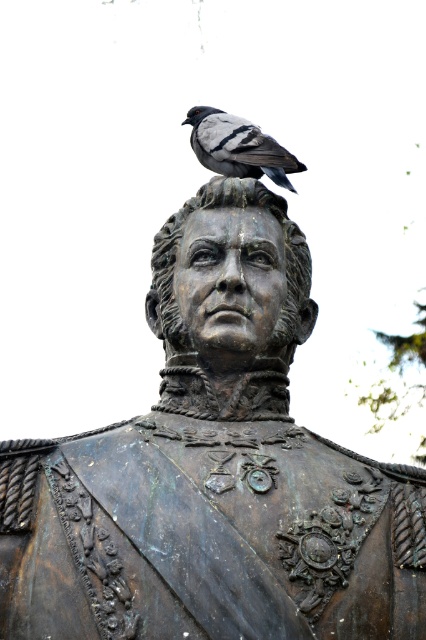
Who is positioned more to the right, bronze statue head at center or gray feathered pigeon at center?

Positioned to the right is bronze statue head at center.

Can you confirm if bronze statue head at center is shorter than gray feathered pigeon at center?

Yes.

Locate an element on the screen. bronze statue head at center is located at coordinates (236, 205).

Which is more to the left, bronze statue at upper center or gray feathered pigeon at center?

bronze statue at upper center

Can you confirm if bronze statue at upper center is positioned to the right of gray feathered pigeon at center?

Incorrect, bronze statue at upper center is not on the right side of gray feathered pigeon at center.

Between point (244, 349) and point (209, 106), which one is positioned behind?

The point (209, 106) is behind.

The height and width of the screenshot is (640, 426). What are the coordinates of `bronze statue at upper center` in the screenshot? It's located at (213, 472).

The height and width of the screenshot is (640, 426). What do you see at coordinates (213, 472) in the screenshot?
I see `bronze statue at upper center` at bounding box center [213, 472].

Between point (183, 611) and point (183, 225), which one is positioned in front?

Point (183, 611)

I want to click on bronze statue at upper center, so click(213, 472).